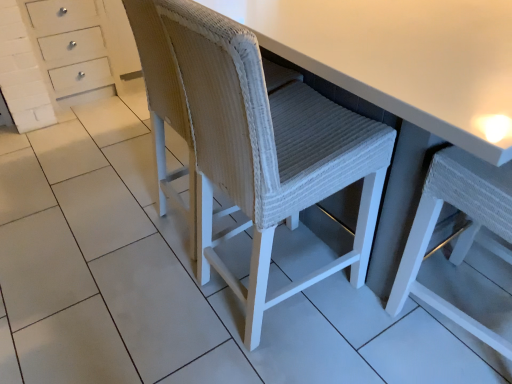
Question: Is white woven chair at center, which ranks as the 1th chair in right-to-left order, bigger or smaller than white woven stool at center?

Choices:
 (A) small
 (B) big

Answer: (A)

Question: Would you say white woven chair at center, which is the 2th chair from left to right, is inside or outside white woven stool at center?

Choices:
 (A) inside
 (B) outside

Answer: (A)

Question: Which object is positioned closest to the white woven chair at center, which ranks as the 1th chair in right-to-left order?

Choices:
 (A) white woven swivel chair at center
 (B) white woven chair at center, which appears as the first chair when viewed from the left
 (C) white woven stool at center

Answer: (C)

Question: Which object is the farthest from the white woven swivel chair at center?

Choices:
 (A) white woven chair at center, which is the 2th chair from left to right
 (B) white woven chair at center, the 2th chair viewed from the right
 (C) white woven stool at center

Answer: (A)